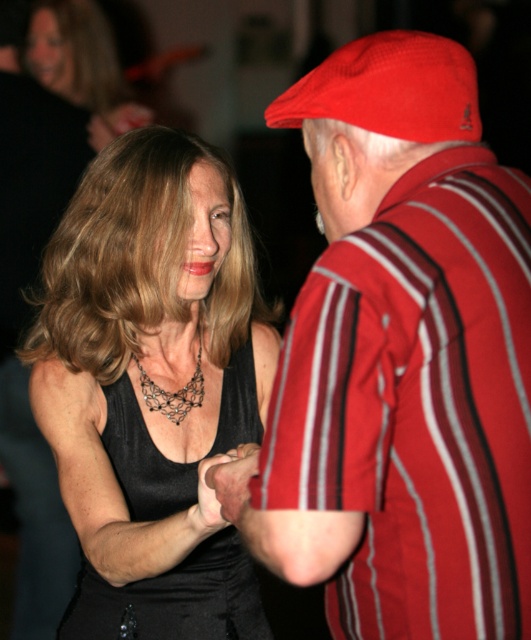
Question: Among these points, which one is nearest to the camera?

Choices:
 (A) (254, 506)
 (B) (82, 10)
 (C) (149, 509)
 (D) (164, 412)

Answer: (A)

Question: Considering the relative positions of black silk dress at center and black satin dress at center in the image provided, where is black silk dress at center located with respect to black satin dress at center?

Choices:
 (A) below
 (B) above

Answer: (B)

Question: Which object appears farthest from the camera in this image?

Choices:
 (A) black silk dress at center
 (B) black lace necklace at center
 (C) red fabric cap at upper right
 (D) black satin dress at center

Answer: (B)

Question: Which of these objects is positioned farthest from the black lace necklace at center?

Choices:
 (A) matte black dress at center
 (B) black silk dress at center
 (C) red fabric cap at upper right
 (D) black satin dress at center

Answer: (A)

Question: Is black silk dress at center positioned in front of black lace necklace at center?

Choices:
 (A) yes
 (B) no

Answer: (A)

Question: Where is black silk dress at center located in relation to black lace necklace at center in the image?

Choices:
 (A) left
 (B) right

Answer: (A)